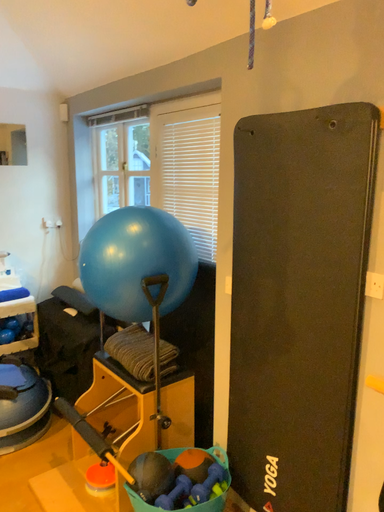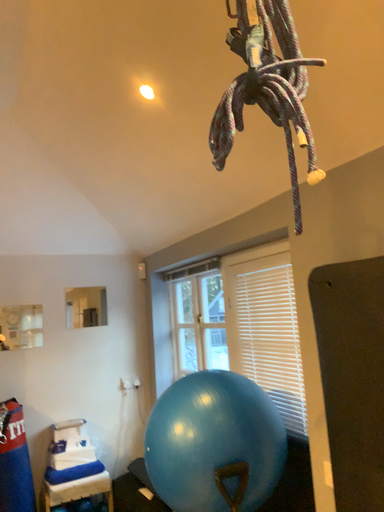
Question: How did the camera likely rotate when shooting the video?

Choices:
 (A) rotated left
 (B) rotated right

Answer: (A)